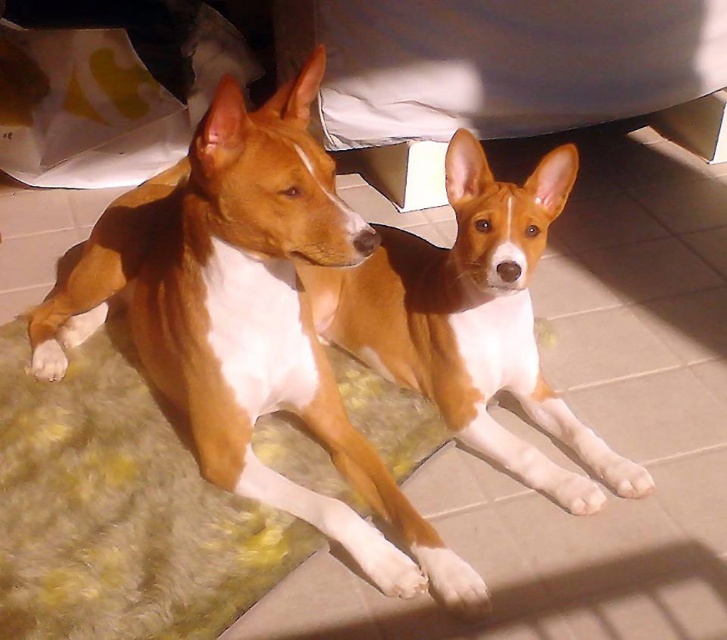
Question: In this image, where is brown shiny fur dog at center located relative to brown/white fur at center?

Choices:
 (A) left
 (B) right

Answer: (A)

Question: Which point appears closest to the camera in this image?

Choices:
 (A) (305, 228)
 (B) (489, 428)

Answer: (A)

Question: Which point is farther to the camera?

Choices:
 (A) brown/white fur at center
 (B) yellow fuzzy mat at lower left

Answer: (A)

Question: Among these points, which one is nearest to the camera?

Choices:
 (A) (582, 483)
 (B) (148, 531)
 (C) (342, 413)

Answer: (B)

Question: Does yellow fuzzy mat at lower left have a greater width compared to brown/white fur at center?

Choices:
 (A) yes
 (B) no

Answer: (A)

Question: Is brown shiny fur dog at center smaller than yellow fuzzy mat at lower left?

Choices:
 (A) yes
 (B) no

Answer: (B)